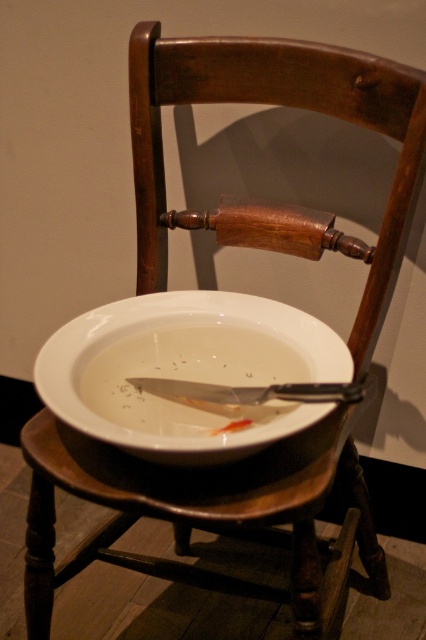
You are a guest at a dinner party and need to sit down. The host points to the wooden stool at center and the white glossy soup bowl at center. Which one is taller?

The wooden stool at center is much taller than the white glossy soup bowl at center.

You are standing in front of the wooden chair with a bowl and knife. There is a point marked at coordinates [203,516]. What object is located at that point?

The point at coordinates [203,516] corresponds to the wooden stool at center.

You are standing 30 inches away from the wooden stool at center. Can you reach it without moving your feet?

The wooden stool at center is 29.25 inches away from you, so yes, you can reach it without moving your feet since it is within your reach.